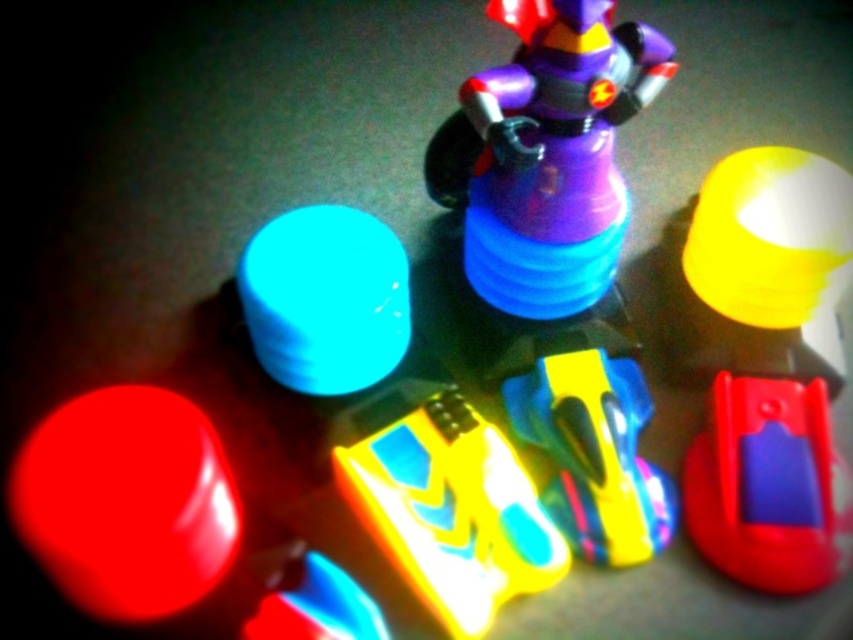
Question: Which point is closer to the camera taking this photo?

Choices:
 (A) pyautogui.click(x=460, y=486)
 (B) pyautogui.click(x=352, y=596)

Answer: (B)

Question: Which point appears closest to the camera in this image?

Choices:
 (A) (750, 547)
 (B) (248, 637)
 (C) (279, 243)

Answer: (B)

Question: Which is farther from the purple matte figure at center?

Choices:
 (A) translucent plastic toy at lower center
 (B) rubberized red toy at lower right

Answer: (A)

Question: Observing the image, what is the correct spatial positioning of purple matte figure at center in reference to matte plastic cup at upper left?

Choices:
 (A) left
 (B) right

Answer: (B)

Question: Does rubberized yellow and blue toy at center have a smaller size compared to translucent plastic toy at lower center?

Choices:
 (A) no
 (B) yes

Answer: (A)

Question: Does matte plastic cup at upper left appear on the right side of translucent plastic toy at lower center?

Choices:
 (A) no
 (B) yes

Answer: (A)